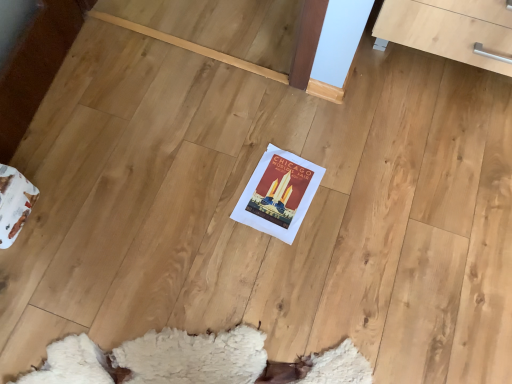
Describe the element at coordinates (278, 194) in the screenshot. I see `white paper magazine at center` at that location.

What is the approximate height of white paper magazine at center?

The height of white paper magazine at center is 0.77 inches.

What is the approximate width of white paper magazine at center?

It is 30.19 centimeters.

Where is `white paper magazine at center`? white paper magazine at center is located at coordinates (278, 194).

What are the coordinates of `white paper magazine at center` in the screenshot? It's located at [x=278, y=194].